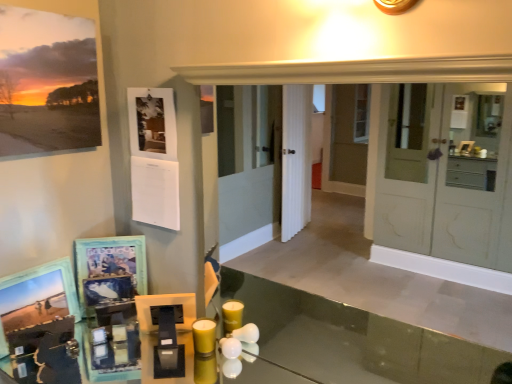
Question: Can you confirm if wooden picture frame at lower left, which appears as the 2th picture frame when viewed from the top, is positioned to the left of matte paper print at upper left, the 3th picture frame when ordered from bottom to top?

Choices:
 (A) yes
 (B) no

Answer: (B)

Question: From a real-world perspective, is wooden picture frame at lower left, which appears as the 2th picture frame when viewed from the top, on top of matte paper print at upper left, the 3th picture frame when ordered from bottom to top?

Choices:
 (A) yes
 (B) no

Answer: (B)

Question: Is wooden picture frame at lower left, which is counted as the 2th picture frame, starting from the bottom, smaller than matte paper print at upper left, the 1th picture frame positioned from the top?

Choices:
 (A) no
 (B) yes

Answer: (B)

Question: Does wooden picture frame at lower left, which is counted as the 2th picture frame, starting from the bottom, have a greater height compared to matte paper print at upper left, the 3th picture frame when ordered from bottom to top?

Choices:
 (A) no
 (B) yes

Answer: (A)

Question: From the image's perspective, is wooden picture frame at lower left, which is counted as the 2th picture frame, starting from the bottom, below matte paper print at upper left, the 3th picture frame when ordered from bottom to top?

Choices:
 (A) yes
 (B) no

Answer: (A)

Question: Is yellow matte candle at lower center inside or outside of wooden picture frame at lower left, which is counted as the 2th picture frame, starting from the bottom?

Choices:
 (A) inside
 (B) outside

Answer: (B)

Question: Looking at the image, does yellow matte candle at lower center seem bigger or smaller compared to wooden picture frame at lower left, which is counted as the 2th picture frame, starting from the bottom?

Choices:
 (A) big
 (B) small

Answer: (B)

Question: Is yellow matte candle at lower center taller or shorter than wooden picture frame at lower left, which is counted as the 2th picture frame, starting from the bottom?

Choices:
 (A) short
 (B) tall

Answer: (A)

Question: From the image's perspective, is yellow matte candle at lower center positioned above or below wooden picture frame at lower left, which appears as the 2th picture frame when viewed from the top?

Choices:
 (A) above
 (B) below

Answer: (B)

Question: Do you think wooden picture frame at lower left, which is counted as the 2th picture frame, starting from the bottom, is within yellow matte candle at lower center, or outside of it?

Choices:
 (A) outside
 (B) inside

Answer: (A)

Question: From a real-world perspective, is wooden picture frame at lower left, which is counted as the 2th picture frame, starting from the bottom, above or below yellow matte candle at lower center?

Choices:
 (A) below
 (B) above

Answer: (B)

Question: From the image's perspective, is wooden picture frame at lower left, which is counted as the 2th picture frame, starting from the bottom, located above or below yellow matte candle at lower center?

Choices:
 (A) below
 (B) above

Answer: (B)

Question: Relative to yellow matte candle at lower center, is wooden picture frame at lower left, which is counted as the 2th picture frame, starting from the bottom, in front or behind?

Choices:
 (A) front
 (B) behind

Answer: (B)

Question: Relative to wooden picture frame at lower left, which is counted as the 2th picture frame, starting from the bottom, is wooden photo frame at lower left, which is counted as the third picture frame, starting from the top, in front or behind?

Choices:
 (A) behind
 (B) front

Answer: (B)

Question: Is wooden photo frame at lower left, which is counted as the third picture frame, starting from the top, spatially inside wooden picture frame at lower left, which appears as the 2th picture frame when viewed from the top, or outside of it?

Choices:
 (A) outside
 (B) inside

Answer: (A)